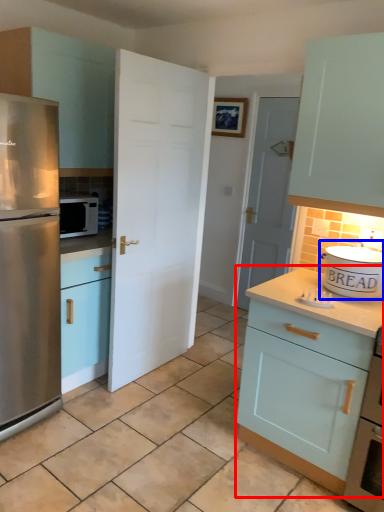
Question: Which point is closer to the camera, cabinetry (highlighted by a red box) or appliance (highlighted by a blue box)?

Choices:
 (A) cabinetry
 (B) appliance

Answer: (A)